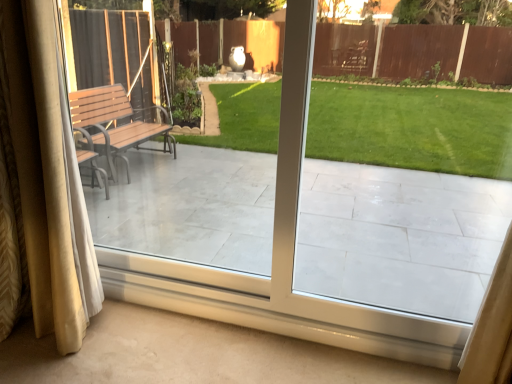
This screenshot has height=384, width=512. Find the location of `white tile porch at center`. white tile porch at center is located at coordinates (400, 237).

The height and width of the screenshot is (384, 512). What do you see at coordinates (400, 237) in the screenshot?
I see `white tile porch at center` at bounding box center [400, 237].

What do you see at coordinates (46, 173) in the screenshot?
I see `silky beige curtains at left` at bounding box center [46, 173].

Locate an element on the screen. The width and height of the screenshot is (512, 384). silky beige curtains at left is located at coordinates (46, 173).

Measure the distance between point (69, 286) and camera.

Point (69, 286) is 5.68 feet away from camera.

Image resolution: width=512 pixels, height=384 pixels. In order to click on white tile porch at center in this screenshot , I will do `click(400, 237)`.

Which object is positioned more to the left, silky beige curtains at left or white tile porch at center?

From the viewer's perspective, silky beige curtains at left appears more on the left side.

Based on the photo, is the depth of silky beige curtains at left greater than that of white tile porch at center?

Yes, silky beige curtains at left is further from the camera.

Considering the positions of point (13, 146) and point (407, 246), is point (13, 146) closer or farther from the camera than point (407, 246)?

Point (13, 146) is closer to the camera than point (407, 246).

From the picture: From the image's perspective, between silky beige curtains at left and white tile porch at center, which one is located above?

white tile porch at center appears higher in the image.

From a real-world perspective, which object stands above the other?

From a 3D spatial view, white tile porch at center is above.

Which of these two, silky beige curtains at left or white tile porch at center, is wider?

silky beige curtains at left is wider.

Considering the relative sizes of silky beige curtains at left and white tile porch at center in the image provided, is silky beige curtains at left taller than white tile porch at center?

Yes, silky beige curtains at left is taller than white tile porch at center.

Between silky beige curtains at left and white tile porch at center, which one has smaller size?

white tile porch at center is smaller.

Is silky beige curtains at left located outside white tile porch at center?

silky beige curtains at left is positioned outside white tile porch at center.

Is silky beige curtains at left beside white tile porch at center?

silky beige curtains at left and white tile porch at center are not in contact.

Is silky beige curtains at left aimed at white tile porch at center?

No, silky beige curtains at left is not aimed at white tile porch at center.

How different are the orientations of silky beige curtains at left and white tile porch at center in degrees?

The angular difference between silky beige curtains at left and white tile porch at center is 1.38 degrees.

Measure the distance from silky beige curtains at left to white tile porch at center.

1.98 meters.

The image size is (512, 384). What are the coordinates of `curtain that appears below the white tile porch at center (from a real-world perspective)` in the screenshot? It's located at (46, 173).

Which object is positioned more to the right, white tile porch at center or silky beige curtains at left?

Positioned to the right is white tile porch at center.

Which object is further away from the camera, white tile porch at center or silky beige curtains at left?

silky beige curtains at left.

Does point (182, 154) come closer to viewer compared to point (27, 88)?

No, it is not.

From the image's perspective, who appears lower, white tile porch at center or silky beige curtains at left?

silky beige curtains at left appears lower in the image.

From a real-world perspective, is white tile porch at center beneath silky beige curtains at left?

No, from a real-world perspective, white tile porch at center is not below silky beige curtains at left.

Between white tile porch at center and silky beige curtains at left, which one has smaller width?

With smaller width is white tile porch at center.

Can you confirm if white tile porch at center is shorter than silky beige curtains at left?

Indeed, white tile porch at center has a lesser height compared to silky beige curtains at left.

Considering the sizes of objects white tile porch at center and silky beige curtains at left in the image provided, who is bigger, white tile porch at center or silky beige curtains at left?

With larger size is silky beige curtains at left.

Is silky beige curtains at left surrounded by white tile porch at center?

No.

Is white tile porch at center with silky beige curtains at left?

No.

Is white tile porch at center looking in the opposite direction of silky beige curtains at left?

white tile porch at center is not turned away from silky beige curtains at left.

What's the angular difference between white tile porch at center and silky beige curtains at left's facing directions?

The facing directions of white tile porch at center and silky beige curtains at left are 1.38 degrees apart.

Where is `porch that is above the silky beige curtains at left (from a real-world perspective)`? porch that is above the silky beige curtains at left (from a real-world perspective) is located at coordinates (x=400, y=237).

The width and height of the screenshot is (512, 384). Find the location of `porch on the right of silky beige curtains at left`. porch on the right of silky beige curtains at left is located at coordinates (400, 237).

This screenshot has height=384, width=512. What are the coordinates of `curtain behind the white tile porch at center` in the screenshot? It's located at (46, 173).